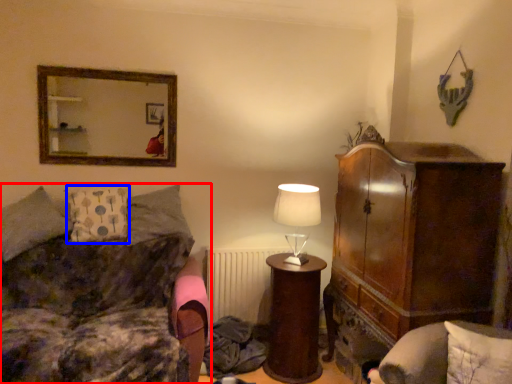
Question: Which of the following is the farthest to the observer, studio couch (highlighted by a red box) or pillow (highlighted by a blue box)?

Choices:
 (A) studio couch
 (B) pillow

Answer: (B)